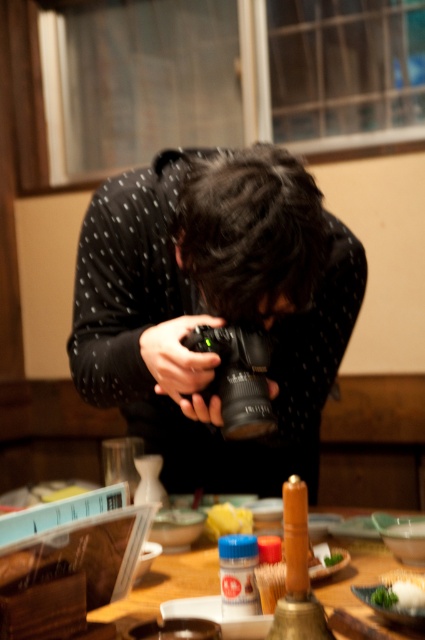
Question: Which of the following is the closest to the observer?

Choices:
 (A) (261, 333)
 (B) (217, 244)
 (C) (316, 588)
 (D) (402, 573)

Answer: (B)

Question: Which point appears farthest from the camera in this image?

Choices:
 (A) tap(404, 600)
 (B) tap(240, 401)
 (C) tap(153, 596)
 (D) tap(209, 321)

Answer: (D)

Question: Does black dotted sweater at center appear on the left side of black plastic camera at center?

Choices:
 (A) yes
 (B) no

Answer: (A)

Question: Which object is farther from the camera taking this photo?

Choices:
 (A) white matte rice at lower right
 (B) black plastic camera at center
 (C) wooden table at center
 (D) black dotted sweater at center

Answer: (B)

Question: Does black dotted sweater at center appear on the right side of black plastic camera at center?

Choices:
 (A) yes
 (B) no

Answer: (B)

Question: Is black dotted sweater at center bigger than white matte rice at lower right?

Choices:
 (A) no
 (B) yes

Answer: (B)